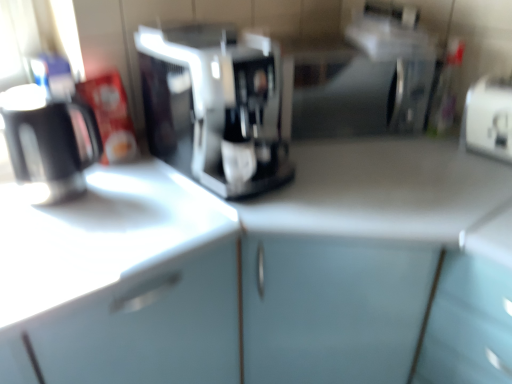
Question: Is sleek silver coffee maker at center situated inside white plastic toaster at right or outside?

Choices:
 (A) inside
 (B) outside

Answer: (B)

Question: Relative to white plastic toaster at right, is sleek silver coffee maker at center in front or behind?

Choices:
 (A) behind
 (B) front

Answer: (B)

Question: Estimate the real-world distances between objects in this image. Which object is closer to the matte black mug at left?

Choices:
 (A) sleek silver coffee maker at center
 (B) white plastic toaster at right
 (C) white glossy counter top at left

Answer: (C)

Question: Which of these objects is positioned closest to the sleek silver coffee maker at center?

Choices:
 (A) white glossy counter top at left
 (B) matte black mug at left
 (C) white plastic toaster at right

Answer: (A)